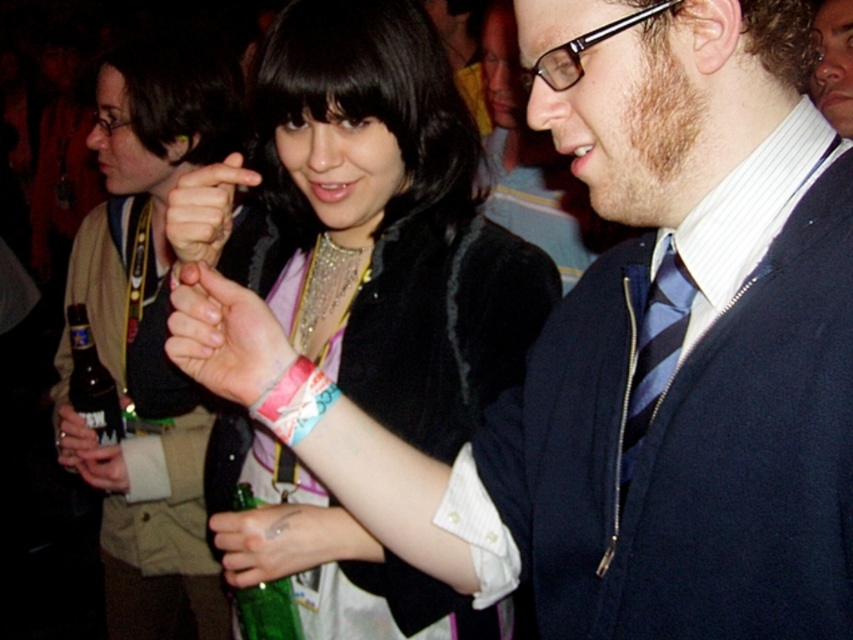
Which is more to the left, matte black jacket at center or clear plastic wristband at center?

From the viewer's perspective, matte black jacket at center appears more on the left side.

Is the position of matte black jacket at center less distant than that of clear plastic wristband at center?

No, it is not.

Between point (112, 58) and point (242, 529), which one is positioned behind?

The point (112, 58) is behind.

You are a GUI agent. You are given a task and a screenshot of the screen. Output one action in this format:
    pyautogui.click(x=<x>, y=<y>)
    Task: Click on the matte black jacket at center
    
    Given the screenshot: What is the action you would take?
    pyautogui.click(x=146, y=173)

Can you confirm if shiny black jacket at center is shorter than pink fabric wristband at center?

No.

Can you confirm if shiny black jacket at center is positioned to the left of pink fabric wristband at center?

No, shiny black jacket at center is not to the left of pink fabric wristband at center.

Where is `shiny black jacket at center`? The image size is (853, 640). shiny black jacket at center is located at coordinates (386, 221).

Between point (109, 483) and point (265, 404), which one is positioned in front?

Positioned in front is point (265, 404).

The width and height of the screenshot is (853, 640). What do you see at coordinates (146, 173) in the screenshot? I see `matte black jacket at center` at bounding box center [146, 173].

At what (x,y) coordinates should I click in order to perform the action: click on matte black jacket at center. Please return your answer as a coordinate pair (x, y). This screenshot has height=640, width=853. Looking at the image, I should click on point(146,173).

Locate an element on the screen. matte black jacket at center is located at coordinates (146, 173).